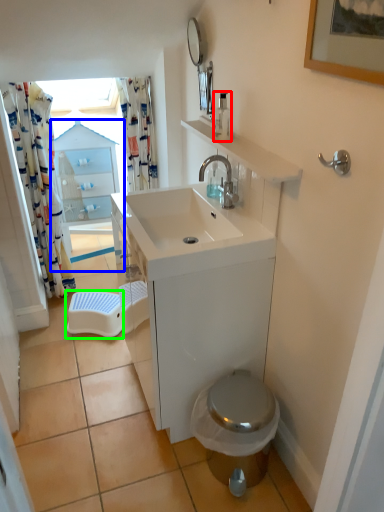
Question: Based on their relative distances, which object is nearer to soap dispenser (highlighted by a red box)? Choose from glass door (highlighted by a blue box) and step stool (highlighted by a green box).

Choices:
 (A) glass door
 (B) step stool

Answer: (B)